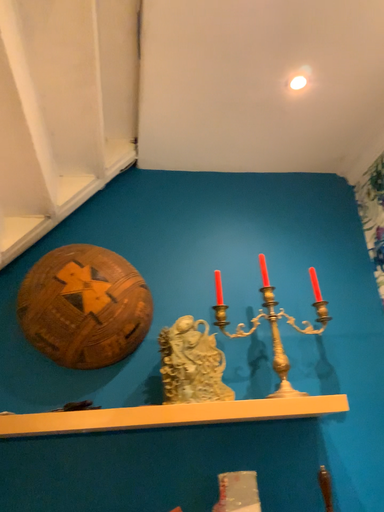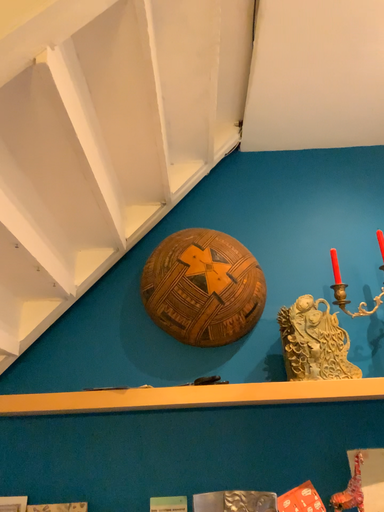
Question: Which way did the camera rotate in the video?

Choices:
 (A) rotated left
 (B) rotated right

Answer: (A)